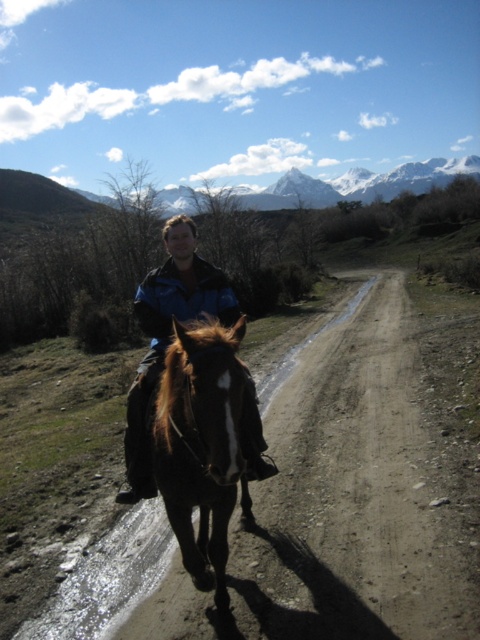
Which is above, dirtmaterial/texturetrack at center or brown glossy horse at center?

brown glossy horse at center

Is dirtmaterial/texturetrack at center thinner than brown glossy horse at center?

Incorrect, dirtmaterial/texturetrack at center's width is not less than brown glossy horse at center's.

Is point (349, 557) farther from viewer compared to point (183, 481)?

Yes, it is.

What are the coordinates of `dirtmaterial/texturetrack at center` in the screenshot? It's located at (343, 504).

In the scene shown: Is dirtmaterial/texturetrack at center positioned behind blue jacket at center?

Yes, it is behind blue jacket at center.

Is dirtmaterial/texturetrack at center shorter than blue jacket at center?

Correct, dirtmaterial/texturetrack at center is not as tall as blue jacket at center.

Which is behind, point (324, 472) or point (172, 240)?

Positioned behind is point (324, 472).

The image size is (480, 640). In order to click on dirtmaterial/texturetrack at center in this screenshot , I will do `click(343, 504)`.

Is point (173, 522) less distant than point (160, 301)?

Yes, point (173, 522) is closer to viewer.

Does brown glossy horse at center lie in front of blue jacket at center?

Yes, brown glossy horse at center is closer to the viewer.

Is point (207, 372) positioned behind point (262, 476)?

No, (207, 372) is in front of (262, 476).

Locate an element on the screen. brown glossy horse at center is located at coordinates (202, 444).